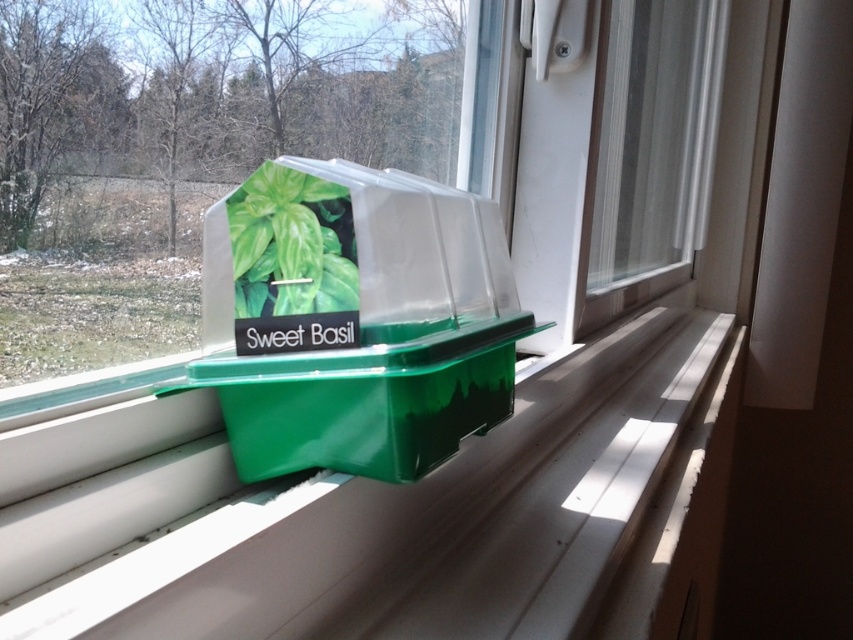
You are a gardener looking at the windowsill setup. You need to place a small plant mister next to the green plastic container at center and the green plastic box at center. Which one is lower and should the mister be placed below or above it?

The green plastic container at center is located below the green plastic box at center. Therefore, the mister should be placed below the green plastic box at center or above the green plastic container at center to ensure proper positioning.

Looking at this image, you are trying to organize your windowsill garden. You have two items on the windowsill, the green plastic container at center and the green plastic box at center. Which one takes up more space on the windowsill?

The green plastic container at center is larger in size than the green plastic box at center, so it takes up more space on the windowsill.